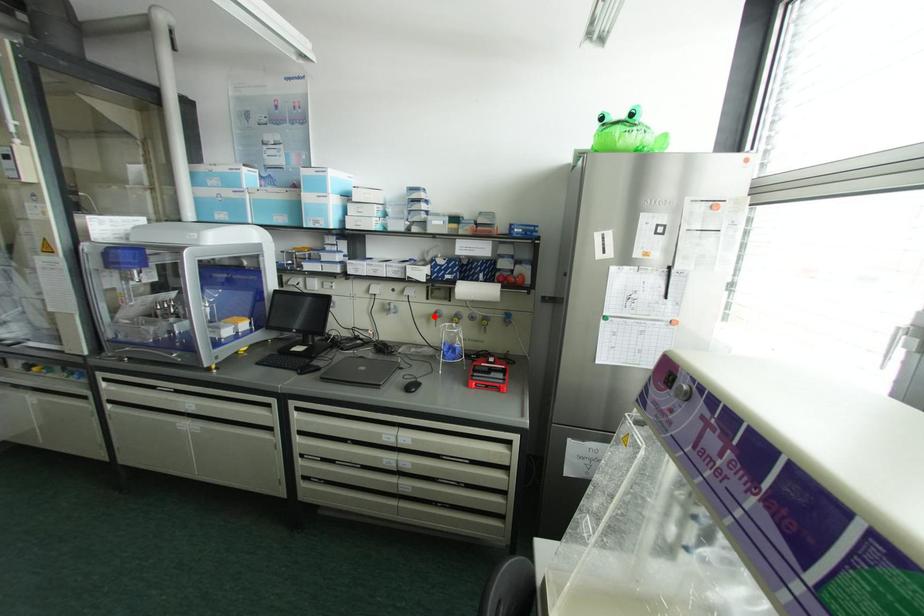
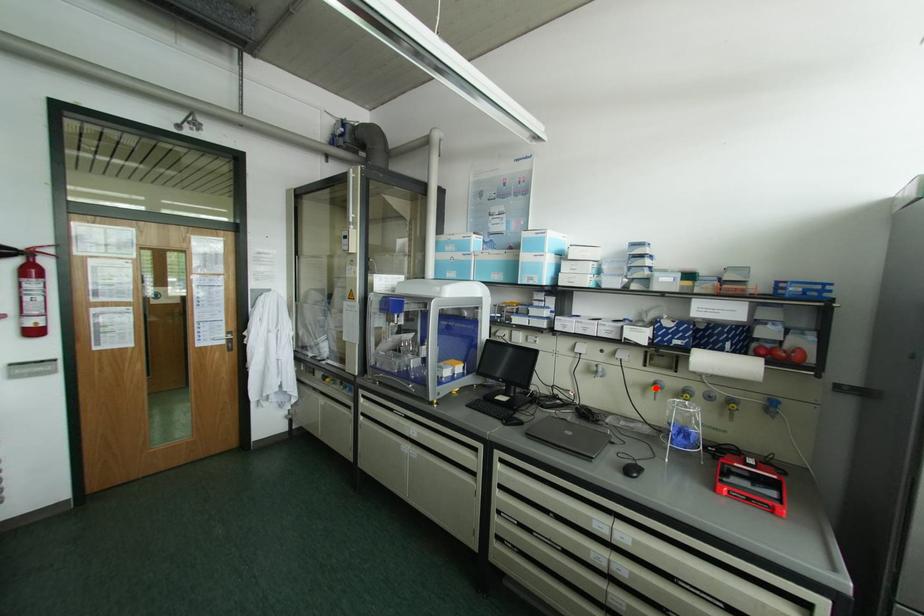
I am providing you with two images of the same scene from different viewpoints. A red point is marked on the first image and another point is marked on the second image. Do the highlighted points in image1 and image2 indicate the same real-world spot?

Yes